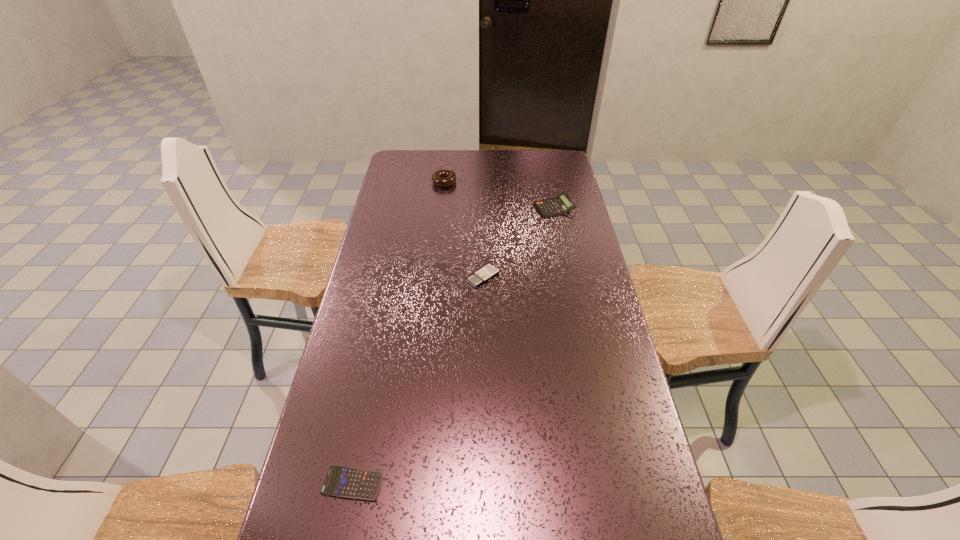
Locate an element on the screen. free space located 0.280m on the front of the second farthest calculator is located at coordinates (483, 357).

Image resolution: width=960 pixels, height=540 pixels. I want to click on vacant space located on the back of the shortest calculator, so click(368, 406).

Locate an element on the screen. object present at the far edge is located at coordinates (443, 178).

Locate an element on the screen. object that is at the left edge is located at coordinates (340, 481).

Where is `object located in the right edge section of the desktop`? The width and height of the screenshot is (960, 540). object located in the right edge section of the desktop is located at coordinates (561, 204).

At what (x,y) coordinates should I click in order to perform the action: click on free region at the far edge. Please return your answer as a coordinate pair (x, y). The width and height of the screenshot is (960, 540). Looking at the image, I should click on click(x=497, y=167).

In the image, there is a desktop. Identify the location of free space at the left edge. (395, 192).

Locate an element on the screen. The width and height of the screenshot is (960, 540). vacant space at the right edge of the desktop is located at coordinates (576, 201).

In order to click on vacant space at the far right corner in this screenshot , I will do `click(542, 166)`.

At what (x,y) coordinates should I click in order to perform the action: click on free spot between the shortest calculator and the tallest calculator. Please return your answer as a coordinate pair (x, y). This screenshot has width=960, height=540. Looking at the image, I should click on (453, 346).